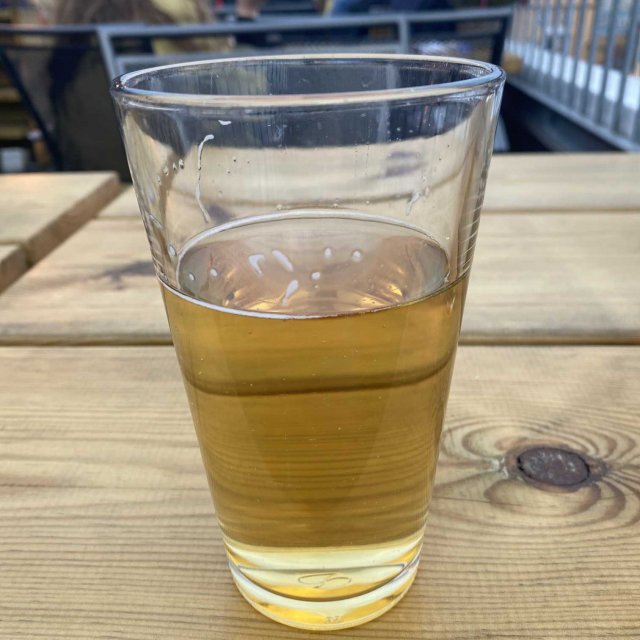
Identify the location of wood table planks. This screenshot has height=640, width=640. (114, 486), (543, 292), (534, 192), (4, 249), (29, 228).